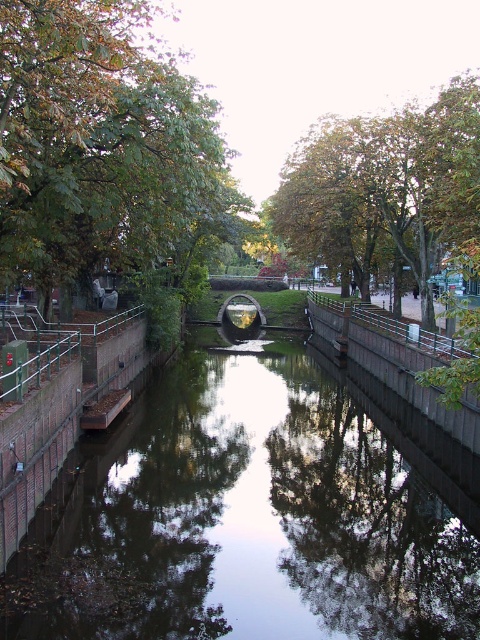
Does smooth concrete canal at center have a smaller size compared to green leafy tree at upper center?

Yes.

Can you confirm if smooth concrete canal at center is positioned below green leafy tree at upper center?

Correct, smooth concrete canal at center is located below green leafy tree at upper center.

Where is `smooth concrete canal at center`? smooth concrete canal at center is located at coordinates (242, 518).

Is green leafy tree at center above green leafy tree at upper center?

Actually, green leafy tree at center is below green leafy tree at upper center.

Which is behind, point (112, 80) or point (331, 134)?

The point (331, 134) is more distant.

Between point (181, 93) and point (437, 172), which one is positioned behind?

The point (437, 172) is behind.

The width and height of the screenshot is (480, 640). I want to click on green leafy tree at center, so click(x=101, y=145).

Image resolution: width=480 pixels, height=640 pixels. Identify the location of smooth concrete canal at center. (242, 518).

From the picture: Is smooth concrete canal at center wider than green leafy tree at center?

Yes.

Who is more forward, (168,397) or (112,38)?

Point (112,38) is more forward.

Where is `smooth concrete canal at center`? Image resolution: width=480 pixels, height=640 pixels. smooth concrete canal at center is located at coordinates (242, 518).